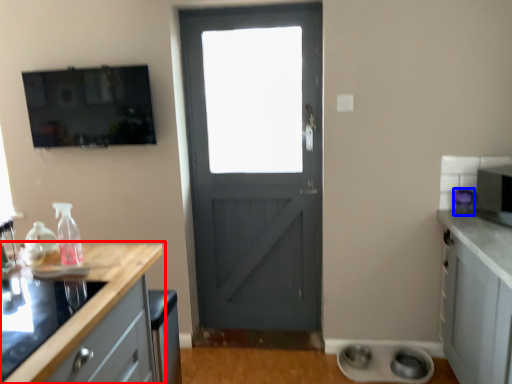
Question: Which point is further to the camera, countertop (highlighted by a red box) or appliance (highlighted by a blue box)?

Choices:
 (A) countertop
 (B) appliance

Answer: (B)